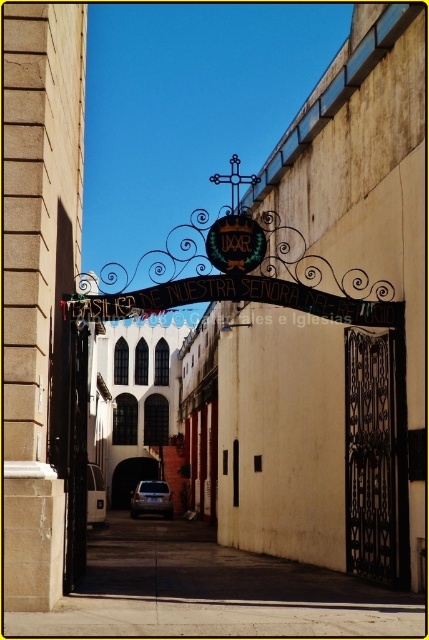
You are a visitor arriving at the Basilica de Nuestra Senora del Refugio. You see a black wrought iron gate at center and a metallic silver car at center. Which object is positioned to the right from your perspective?

The black wrought iron gate at center is to the right of the metallic silver car at center.

You are standing in front of the Basilica de Nuestra Senora del Refugio and want to enter through the gates. There are two gates present, the black wrought iron gate at center and the black metal gate at lower left. Which gate is closer to you as you stand at the entrance?

The black wrought iron gate at center is closer to you because it is further to the viewer than the black metal gate at lower left, meaning it is positioned nearer in the visual perspective.

Looking at this image, you are a tourist standing at the entrance of the Basilica de Nuestra Senora del Refugio. You see a black wrought iron gate at center and a metallic silver car at center. Which object is positioned higher from the ground?

The black wrought iron gate at center is positioned higher from the ground than the metallic silver car at center.